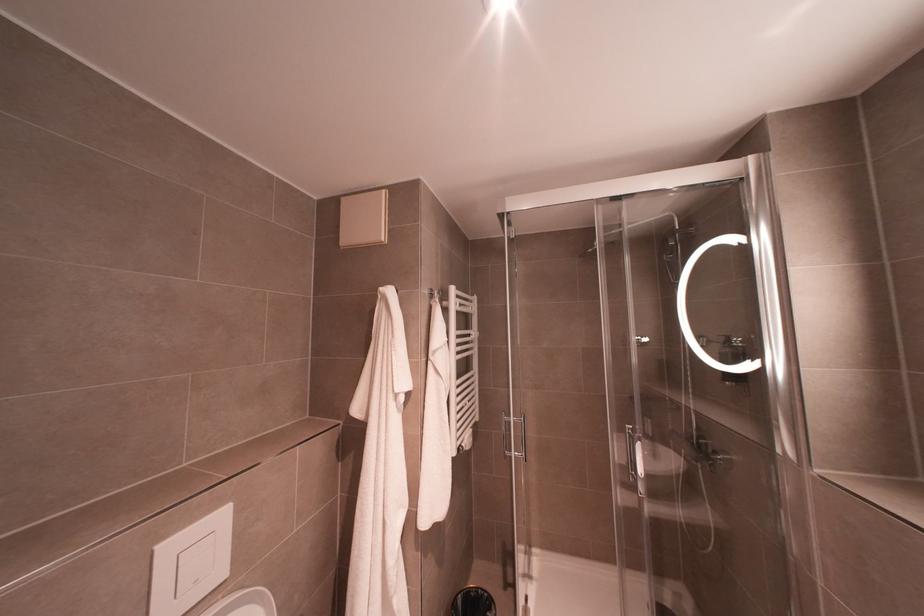
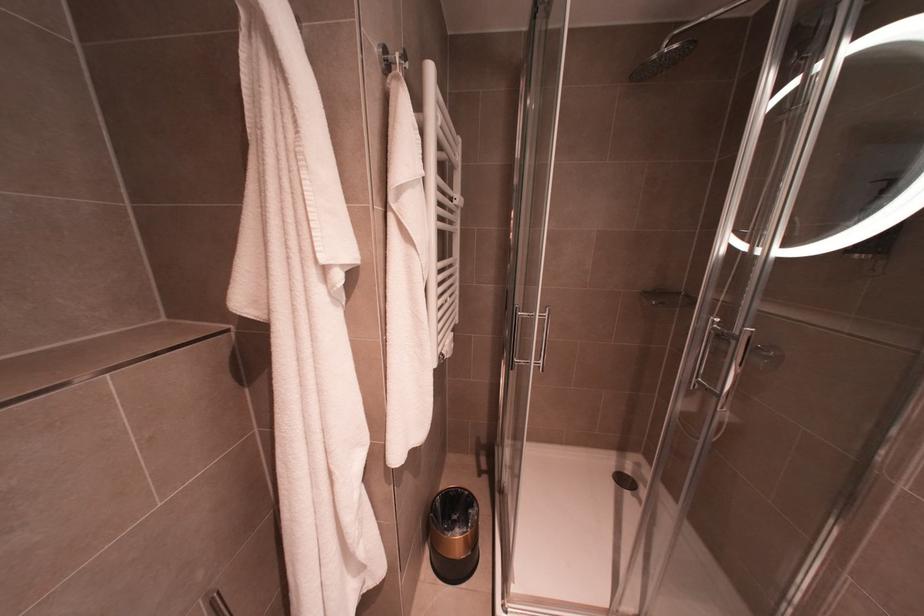
Question: In a continuous first-person perspective shot, in which direction is the camera moving?

Choices:
 (A) Left
 (B) Right
 (C) Forward
 (D) Backward

Answer: (C)